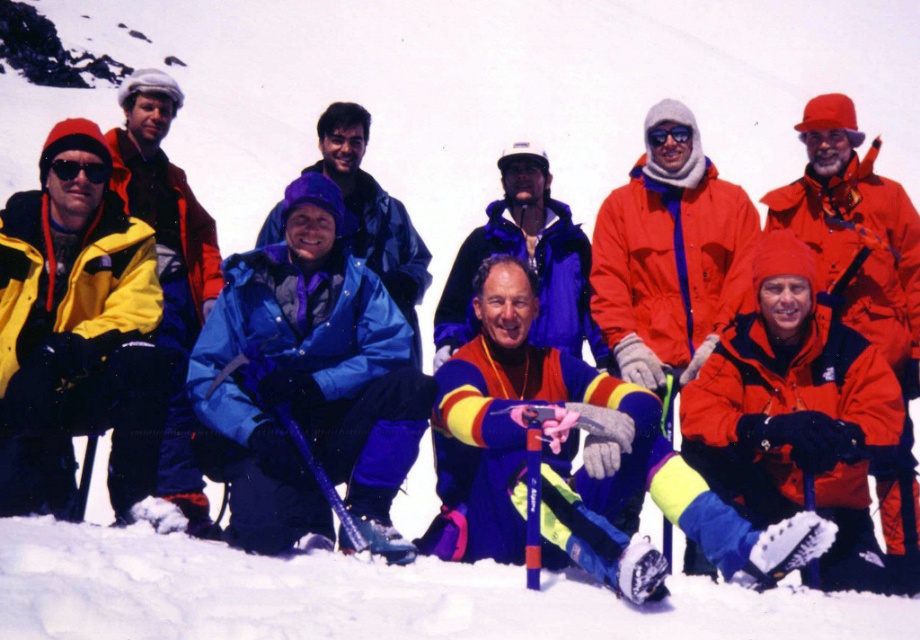
In the scene shown: Which is below, matte yellow jacket at left or matte blue jacket at center?

matte yellow jacket at left is below.

How distant is matte yellow jacket at left from matte blue jacket at center?

4.17 meters

Locate an element on the screen. The height and width of the screenshot is (640, 920). matte yellow jacket at left is located at coordinates (77, 330).

Consider the image. How far apart are yellow and purple snow pants at lower center and blue matte jacket at center?

yellow and purple snow pants at lower center is 5.73 meters away from blue matte jacket at center.

Who is more forward, [744,564] or [358,156]?

Positioned in front is point [744,564].

Where is `yellow and purple snow pants at lower center`? The width and height of the screenshot is (920, 640). yellow and purple snow pants at lower center is located at coordinates (583, 456).

Can you confirm if matte blue jacket at center is positioned below blue matte jacket at center?

Correct, matte blue jacket at center is located below blue matte jacket at center.

You are a GUI agent. You are given a task and a screenshot of the screen. Output one action in this format:
    pyautogui.click(x=<x>, y=<y>)
    Task: Click on the matte blue jacket at center
    This screenshot has height=640, width=920.
    Given the screenshot: What is the action you would take?
    pyautogui.click(x=526, y=260)